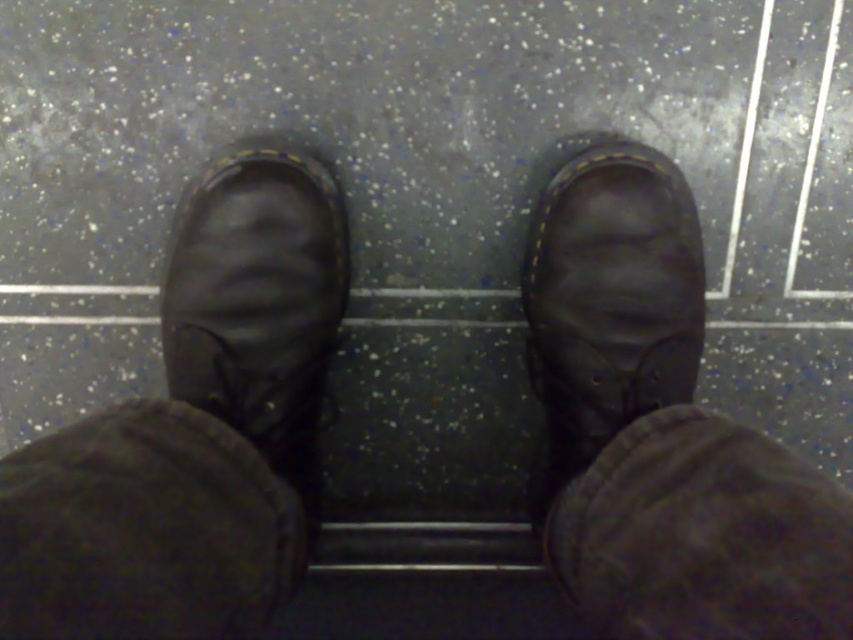
Is matte black shoe at center positioned before matte black shoe at right?

Yes, it is.

Who is more forward, (x=292, y=342) or (x=634, y=305)?

Point (x=634, y=305)

Locate an element on the screen. The width and height of the screenshot is (853, 640). matte black shoe at center is located at coordinates (257, 298).